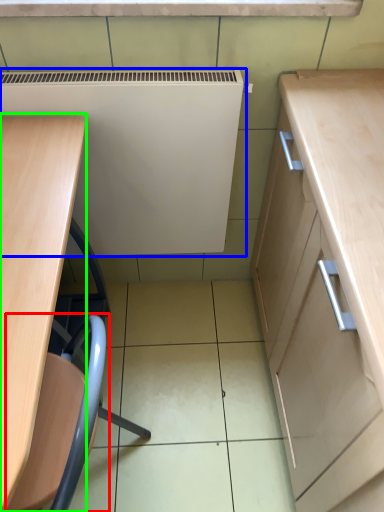
Question: Based on their relative distances, which object is farther from swivel chair (highlighted by a red box)? Choose from appliance (highlighted by a blue box) and desk (highlighted by a green box).

Choices:
 (A) appliance
 (B) desk

Answer: (A)